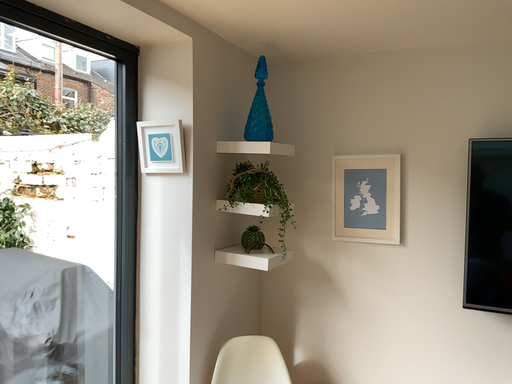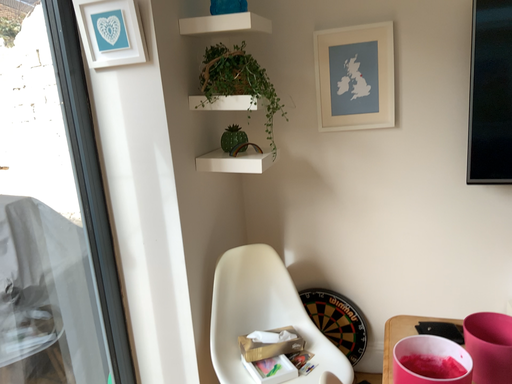
Question: Which way did the camera rotate in the video?

Choices:
 (A) rotated left
 (B) rotated right

Answer: (B)